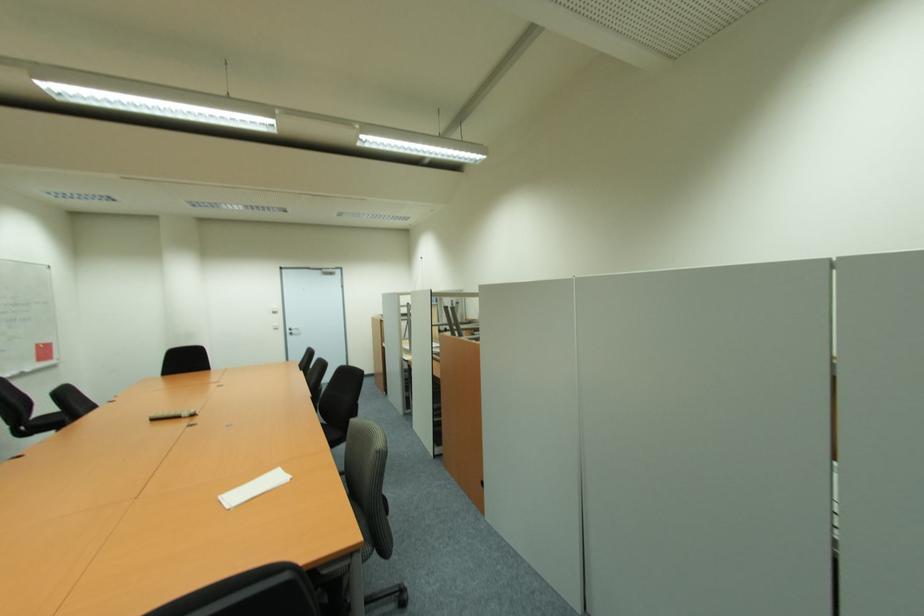
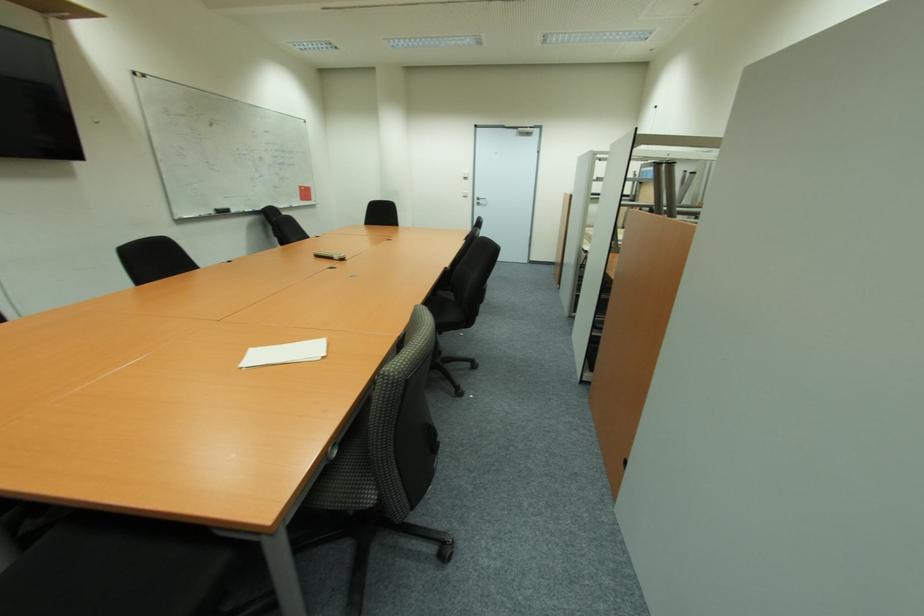
Where in the second image is the point corresponding to (297,331) from the first image?

(483, 203)